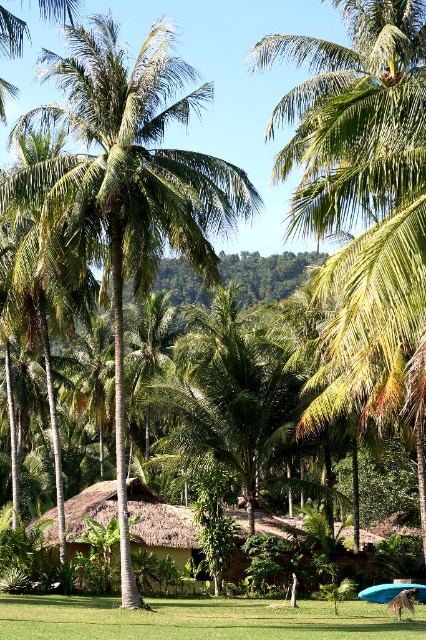
Question: Which point is farther to the camera?

Choices:
 (A) (132, 106)
 (B) (271, 612)

Answer: (B)

Question: Does green leafy palm tree at center appear on the right side of green grass at lower center?

Choices:
 (A) yes
 (B) no

Answer: (B)

Question: Which of the following is the closest to the observer?

Choices:
 (A) (184, 612)
 (B) (20, 189)

Answer: (B)

Question: Does green leafy palm tree at center come in front of green grass at lower center?

Choices:
 (A) yes
 (B) no

Answer: (B)

Question: Does green leafy palm tree at center appear on the left side of green grass at lower center?

Choices:
 (A) yes
 (B) no

Answer: (A)